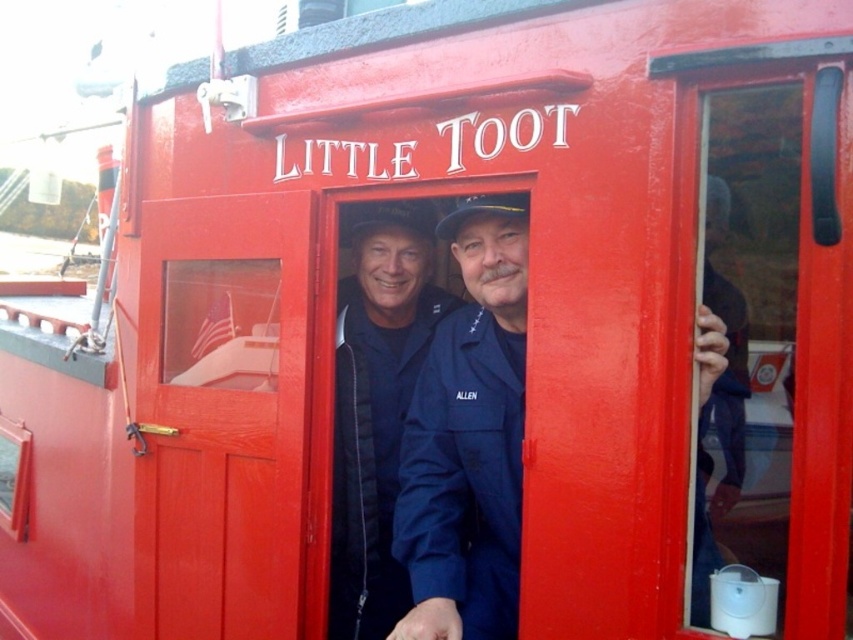
You are on the boat and need to hand a tool to the person wearing the blue fabric jacket at center and the blue denim jacket at right. Since you are standing at the front of the boat, which jacket is closer to your left side?

The blue fabric jacket at center is to the left of the blue denim jacket at right, so the blue fabric jacket at center is closer to your left side.

You are a photographer taking a picture of the two men inside the boat cabin. The blue fabric uniform at center and the blue denim jacket at right are both in your view. Which clothing item is closer to your camera lens?

The blue fabric uniform at center is closer to the camera lens because it is further to the viewer than the blue denim jacket at right.

You are a tailor who needs to determine which item to use for a new uniform design. Given the blue fabric uniform at center and the blue fabric jacket at center, which one has a thinner fabric?

The blue fabric uniform at center has a thinner fabric than the blue fabric jacket at center according to the description.